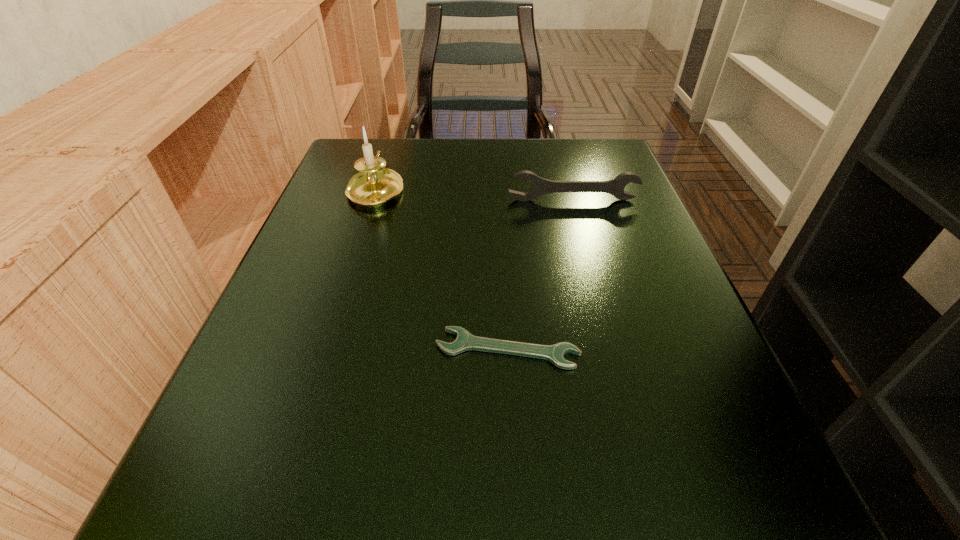
You are a GUI agent. You are given a task and a screenshot of the screen. Output one action in this format:
    pyautogui.click(x=<x>, y=<y>)
    Task: Click on the free space at the far right corner of the desktop
    The height and width of the screenshot is (540, 960).
    Given the screenshot: What is the action you would take?
    pyautogui.click(x=628, y=168)

Locate an element on the screen. The width and height of the screenshot is (960, 540). vacant region at the near right corner of the desktop is located at coordinates (741, 468).

The width and height of the screenshot is (960, 540). In order to click on free space between the taller wrench and the nearest object in this screenshot , I will do `click(540, 275)`.

The width and height of the screenshot is (960, 540). Identify the location of vacant area between the leftmost object and the taller wrench. (474, 194).

At what (x,y) coordinates should I click in order to perform the action: click on free space between the candle holder and the farther wrench. Please return your answer as a coordinate pair (x, y). Image resolution: width=960 pixels, height=540 pixels. Looking at the image, I should click on (474, 194).

At what (x,y) coordinates should I click in order to perform the action: click on empty location between the second shortest object and the candle holder. Please return your answer as a coordinate pair (x, y). Looking at the image, I should click on (474, 194).

The image size is (960, 540). I want to click on vacant area between the farther wrench and the leftmost object, so click(x=474, y=194).

Identify the location of empty space between the candle holder and the nearer wrench. This screenshot has height=540, width=960. (442, 269).

You are a GUI agent. You are given a task and a screenshot of the screen. Output one action in this format:
    pyautogui.click(x=<x>, y=<y>)
    Task: Click on the vacant point located between the shorter wrench and the candle holder
    The width and height of the screenshot is (960, 540).
    Given the screenshot: What is the action you would take?
    pyautogui.click(x=442, y=269)

You are a GUI agent. You are given a task and a screenshot of the screen. Output one action in this format:
    pyautogui.click(x=<x>, y=<y>)
    Task: Click on the free space between the shortest object and the tallest object
    
    Given the screenshot: What is the action you would take?
    pyautogui.click(x=442, y=269)